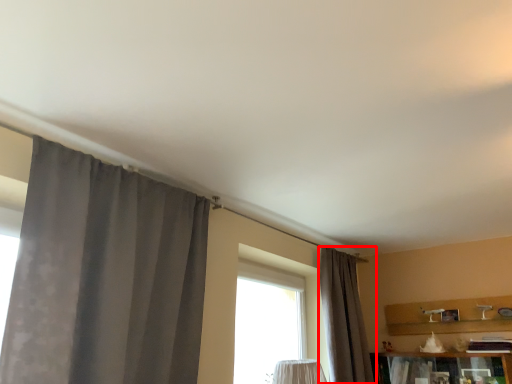
Question: Observing the image, what is the correct spatial positioning of curtain (annotated by the red box) in reference to curtain?

Choices:
 (A) right
 (B) left

Answer: (A)